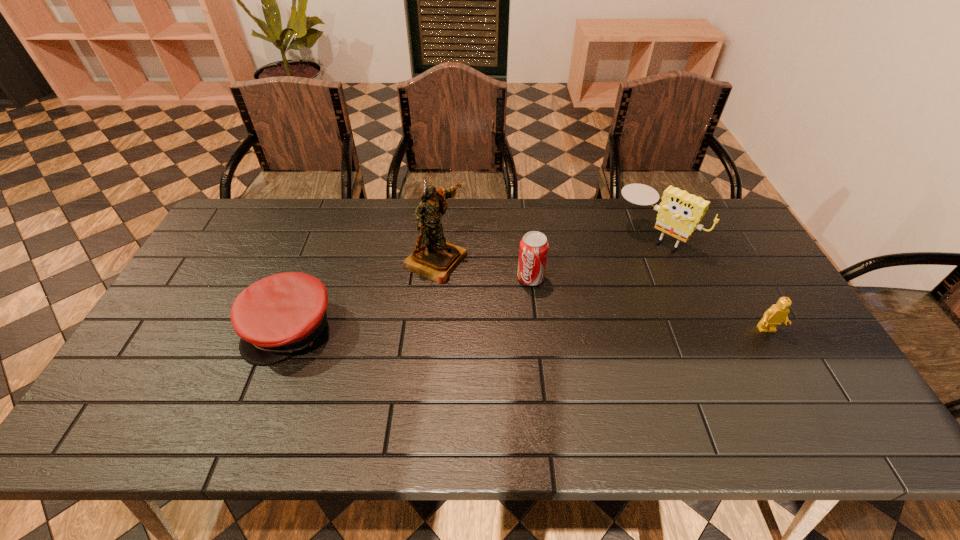
Identify the location of blank region between the soda can and the sponge. (591, 258).

Image resolution: width=960 pixels, height=540 pixels. Find the location of `vacant area that lies between the soda can and the Lego`. vacant area that lies between the soda can and the Lego is located at coordinates (649, 304).

This screenshot has width=960, height=540. I want to click on free space between the third object from right to left and the second tallest object, so click(591, 258).

Identify the location of vacant space in between the Lego and the third object from left to right. This screenshot has height=540, width=960. (649, 304).

Where is `vacant space that's between the cap and the tallest object`? The height and width of the screenshot is (540, 960). vacant space that's between the cap and the tallest object is located at coordinates (364, 295).

Identify the location of vacant space that is in between the sponge and the cap. (471, 283).

At what (x,y) coordinates should I click in order to perform the action: click on unoccupied area between the cap and the second tallest object. Please return your answer as a coordinate pair (x, y). Image resolution: width=960 pixels, height=540 pixels. Looking at the image, I should click on (471, 283).

Point out which object is positioned as the fourth nearest to the rightmost object. Please provide its 2D coordinates. Your answer should be formatted as a tuple, i.e. [(x, y)], where the tuple contains the x and y coordinates of a point satisfying the conditions above.

[(277, 316)]

Select which object is the second closest to the figurine. Please provide its 2D coordinates. Your answer should be formatted as a tuple, i.e. [(x, y)], where the tuple contains the x and y coordinates of a point satisfying the conditions above.

[(277, 316)]